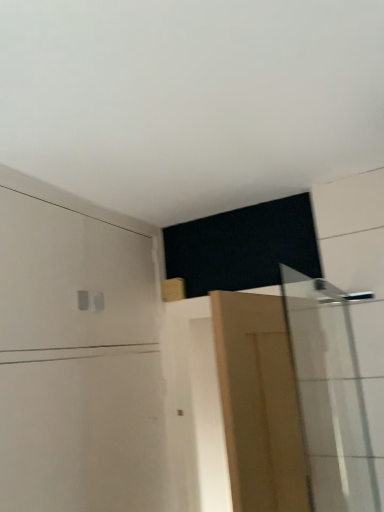
Question: Is white glossy shower door at right at the back of light brown wooden door at center?

Choices:
 (A) yes
 (B) no

Answer: (A)

Question: Is light brown wooden door at center not near white glossy shower door at right?

Choices:
 (A) no
 (B) yes

Answer: (A)

Question: Does light brown wooden door at center lie behind white glossy shower door at right?

Choices:
 (A) yes
 (B) no

Answer: (B)

Question: Does light brown wooden door at center lie in front of white glossy shower door at right?

Choices:
 (A) yes
 (B) no

Answer: (A)

Question: From the image's perspective, would you say light brown wooden door at center is positioned over white glossy shower door at right?

Choices:
 (A) no
 (B) yes

Answer: (A)

Question: Is light brown wooden door at center thinner than white glossy shower door at right?

Choices:
 (A) yes
 (B) no

Answer: (B)

Question: Is light brown wooden door at center facing towards white matte dresser at upper left?

Choices:
 (A) no
 (B) yes

Answer: (B)

Question: Is light brown wooden door at center turned away from white matte dresser at upper left?

Choices:
 (A) yes
 (B) no

Answer: (B)

Question: Is light brown wooden door at center shorter than white matte dresser at upper left?

Choices:
 (A) no
 (B) yes

Answer: (B)

Question: From a real-world perspective, is light brown wooden door at center under white matte dresser at upper left?

Choices:
 (A) yes
 (B) no

Answer: (A)

Question: Is light brown wooden door at center far from white matte dresser at upper left?

Choices:
 (A) no
 (B) yes

Answer: (A)

Question: Is white matte dresser at upper left completely or partially inside light brown wooden door at center?

Choices:
 (A) yes
 (B) no

Answer: (B)

Question: Is white glossy shower door at right further to camera compared to light brown wooden door at center?

Choices:
 (A) yes
 (B) no

Answer: (A)